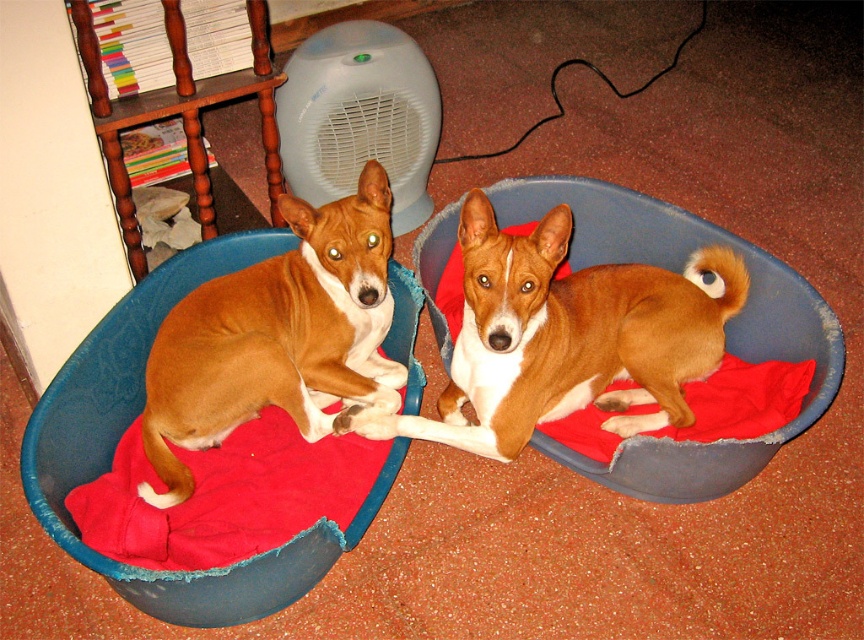
You are a dog trainer observing the brown matte dog at left. What are the coordinates of its position?

The coordinates of the brown matte dog at left are at point (278, 337).

You are a photographer standing in front of the two dogs resting in their beds. You want to take a photo that includes both dogs clearly. Which dog should you focus on first to ensure both are in focus? The dogs are at point (329, 284) and point (201, 616) respectively.

You should focus on the dog at point (329, 284) first because it is closer to the camera than the dog at point (201, 616). By focusing on the closer dog, the farther one will also be in focus due to the depth of field.

You are a pet owner who wants to place a new toy between the two dogs. The toy needs to be placed exactly at the point labeled as point (x=135, y=417). Based on the scene description, where is this point located?

The point (x=135, y=417) is on the velvet like blue pet bed at left.